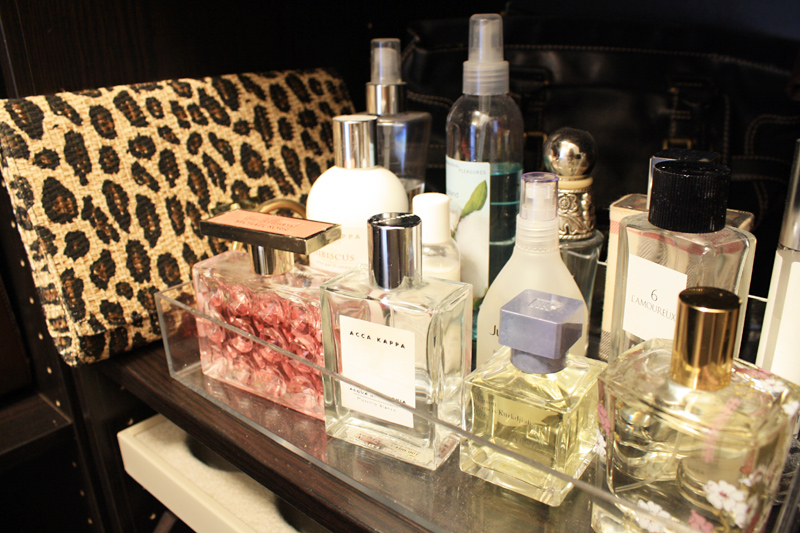
At what (x,y) coordinates should I click in order to perform the action: click on bottle with flowers on it. Please return your answer as a coordinate pair (x, y). This screenshot has width=800, height=533. Looking at the image, I should click on (718, 450), (282, 310).